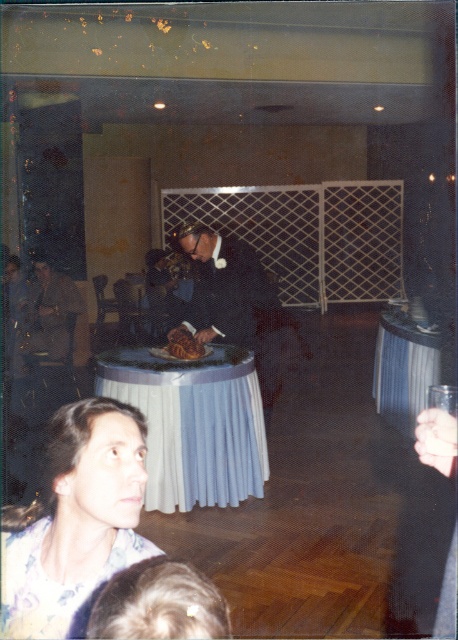
How far apart are floral print blouse at lower left and white cloth table at center?

floral print blouse at lower left is 3.63 meters away from white cloth table at center.

Does floral print blouse at lower left appear on the right side of white cloth table at center?

Incorrect, floral print blouse at lower left is not on the right side of white cloth table at center.

The height and width of the screenshot is (640, 458). I want to click on floral print blouse at lower left, so click(x=75, y=520).

Who is positioned more to the left, shiny black suit at center or golden brown pastry at center?

From the viewer's perspective, golden brown pastry at center appears more on the left side.

Can you confirm if shiny black suit at center is wider than golden brown pastry at center?

Yes.

Which is behind, point (205, 236) or point (175, 356)?

Point (175, 356)

Identify the location of shiny black suit at center. Image resolution: width=458 pixels, height=640 pixels. (234, 300).

Looking at this image, which of these two, blue pleated tablecloth at center or brown leather jacket at left, stands taller?

With more height is brown leather jacket at left.

Based on the photo, does blue pleated tablecloth at center have a larger size compared to brown leather jacket at left?

No, blue pleated tablecloth at center is not bigger than brown leather jacket at left.

Is point (225, 410) positioned before point (50, 278)?

Yes, point (225, 410) is closer to viewer.

Locate an element on the screen. The width and height of the screenshot is (458, 640). blue pleated tablecloth at center is located at coordinates (194, 424).